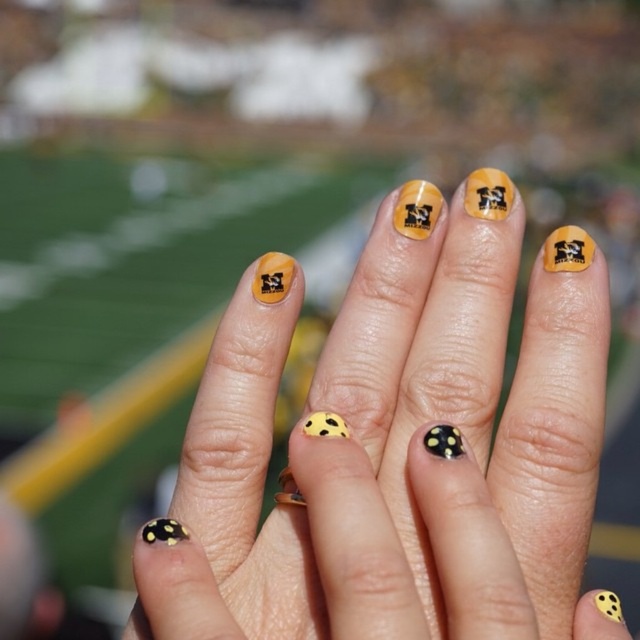
Question: Can you confirm if yellow matte nail art at center is positioned above yellow matte polka dot at center?

Choices:
 (A) yes
 (B) no

Answer: (B)

Question: Is yellow matte nail art at center behind yellow matte polka dot at center?

Choices:
 (A) yes
 (B) no

Answer: (B)

Question: Which point is farther to the camera?

Choices:
 (A) yellow matte nail art at center
 (B) yellow matte polka dot at center

Answer: (B)

Question: Among these points, which one is nearest to the camera?

Choices:
 (A) (445, 636)
 (B) (323, 432)

Answer: (A)

Question: Can you confirm if yellow matte nail art at center is positioned above yellow matte polka dot at center?

Choices:
 (A) no
 (B) yes

Answer: (A)